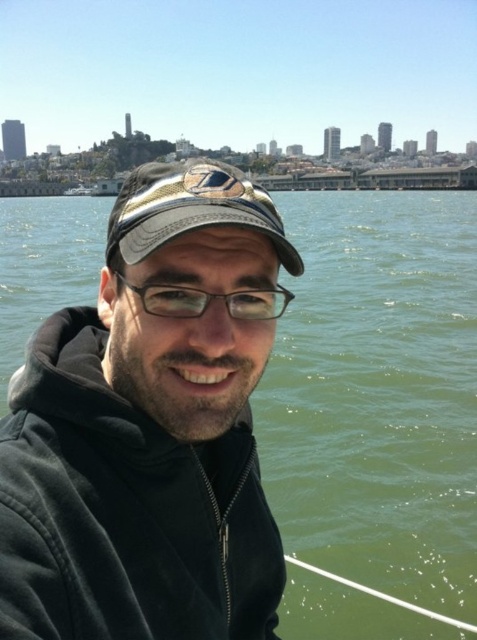
Question: Which object appears farthest from the camera in this image?

Choices:
 (A) green water at center
 (B) transparent plastic glasses at center
 (C) metallic gold cap at center

Answer: (A)

Question: Which object is positioned closest to the metallic gold cap at center?

Choices:
 (A) transparent plastic glasses at center
 (B) green water at center

Answer: (A)

Question: Considering the relative positions of metallic gold cap at center and transparent plastic glasses at center in the image provided, where is metallic gold cap at center located with respect to transparent plastic glasses at center?

Choices:
 (A) left
 (B) right

Answer: (A)

Question: Which point is farther to the camera?

Choices:
 (A) (436, 225)
 (B) (208, 298)
 (C) (137, 211)

Answer: (A)

Question: Can you confirm if metallic gold cap at center is bigger than transparent plastic glasses at center?

Choices:
 (A) no
 (B) yes

Answer: (B)

Question: From the image, what is the correct spatial relationship of green water at center in relation to metallic gold cap at center?

Choices:
 (A) right
 (B) left

Answer: (B)